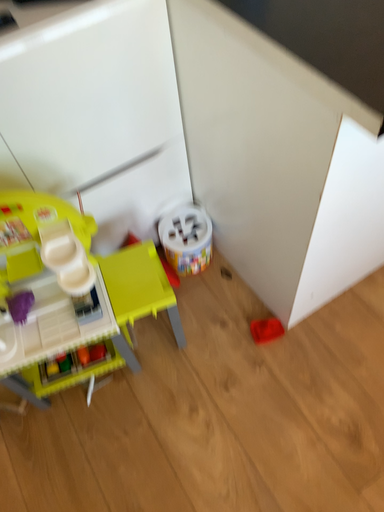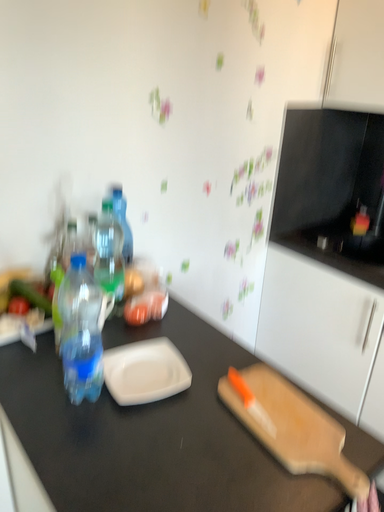
Question: How did the camera likely rotate when shooting the video?

Choices:
 (A) rotated downward
 (B) rotated upward

Answer: (B)